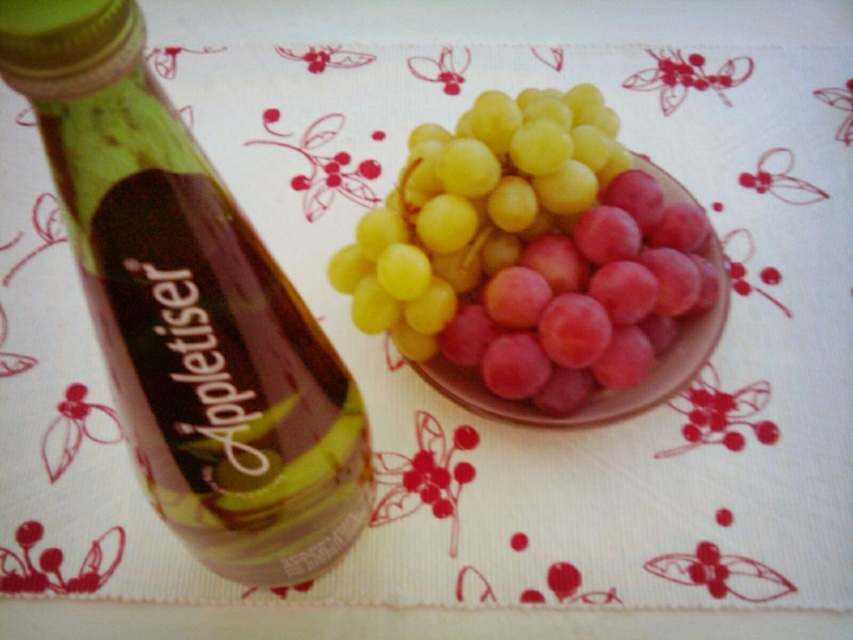
You are arranging a picnic basket and have the green glass bottle at left and the yellow matte grapes at center. Which item is positioned lower in the basket?

The green glass bottle at left is located below the yellow matte grapes at center, so it is positioned lower in the basket.